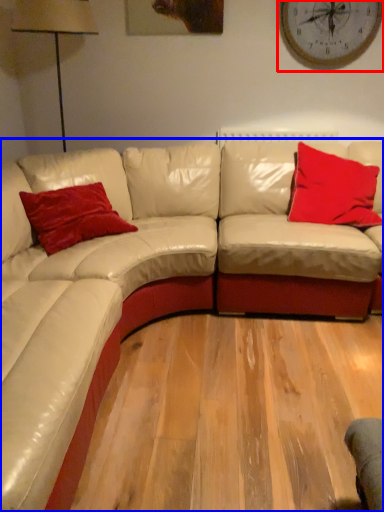
Question: Among these objects, which one is farthest to the camera, clock (highlighted by a red box) or studio couch (highlighted by a blue box)?

Choices:
 (A) clock
 (B) studio couch

Answer: (A)